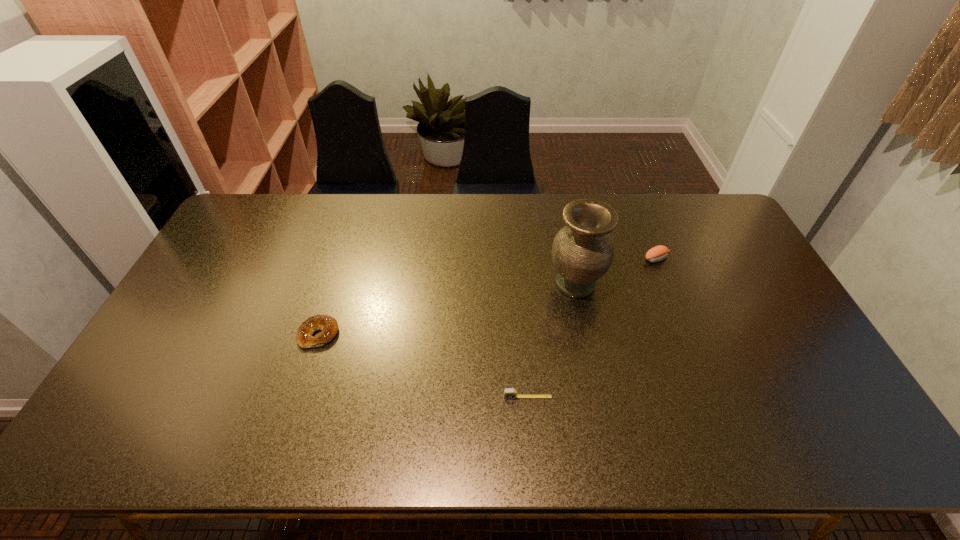
I want to click on vacant area in the image that satisfies the following two spatial constraints: 1. on the back side of the sushi; 2. on the left side of the third farthest object, so click(x=342, y=259).